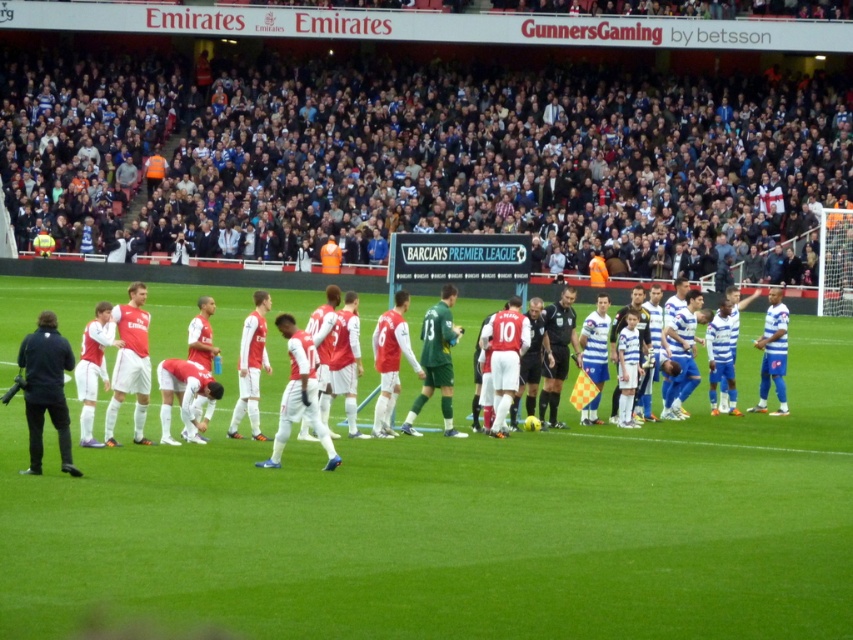
You are a drone operator trying to capture aerial footage of the Emirates Stadium football match. You need to ensure your drone stays within the green grass field at center. Given that the coordinates of the field are from 0.5 to 0.9 on the x and y axes, is the point at (453, 524) within the field?

The point at (453, 524) is within the green grass field at center because its coordinates fall within the specified range of 0.5 to 0.9 on both the x and y axes.

Based on the photo, you are a photographer standing at the edge of the green grass field at center and dark blue jersey at upper center. Which object is closer to you?

The dark blue jersey at upper center is closer to you because it is positioned above the green grass field at center.